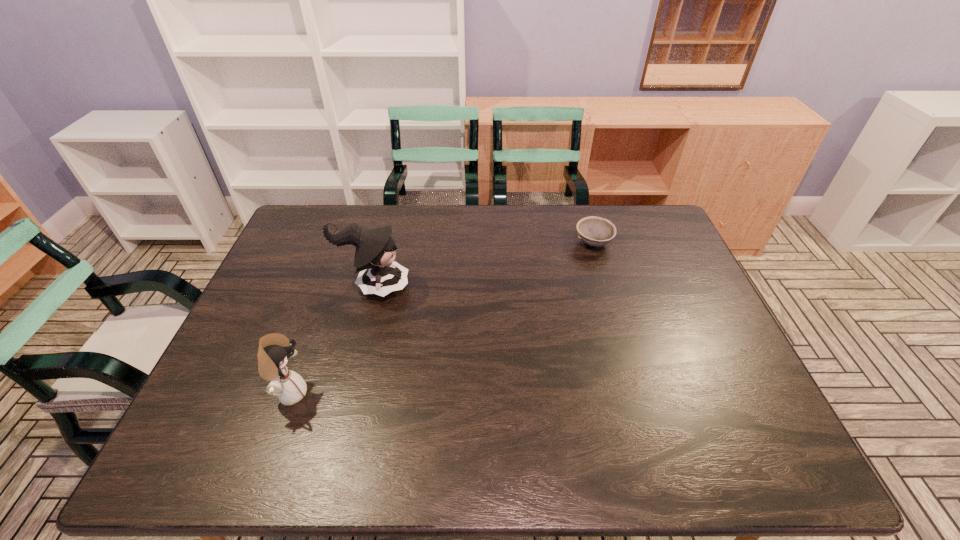
You are a GUI agent. You are given a task and a screenshot of the screen. Output one action in this format:
    pyautogui.click(x=<x>, y=<y>)
    Task: Click on the vacant area that satisfies the following two spatial constraints: 1. on the front side of the farthest object; 2. at the face of the second farthest object
    
    Given the screenshot: What is the action you would take?
    pyautogui.click(x=607, y=287)

I want to click on free space that satisfies the following two spatial constraints: 1. on the front side of the farthest object; 2. at the front face of the shorter doll, so click(638, 393).